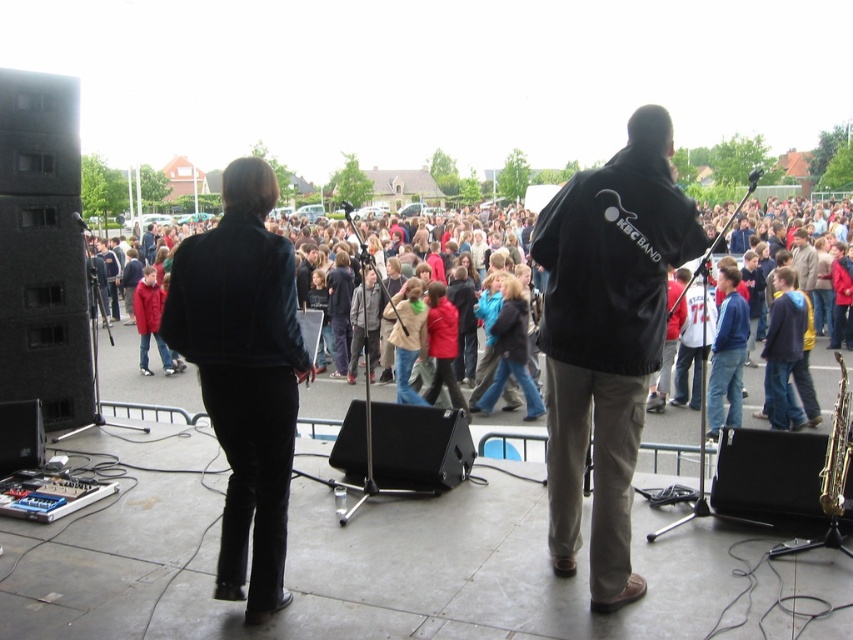
Looking at this image, can you confirm if black fabric jacket at center is smaller than gold metallic saxophone at lower right?

No, black fabric jacket at center is not smaller than gold metallic saxophone at lower right.

Between black fabric jacket at center and gold metallic saxophone at lower right, which one appears on the right side from the viewer's perspective?

Positioned to the right is gold metallic saxophone at lower right.

At what (x,y) coordinates should I click in order to perform the action: click on black fabric jacket at center. Please return your answer as a coordinate pair (x, y). Looking at the image, I should click on (606, 339).

Identify the location of black fabric jacket at center. (606, 339).